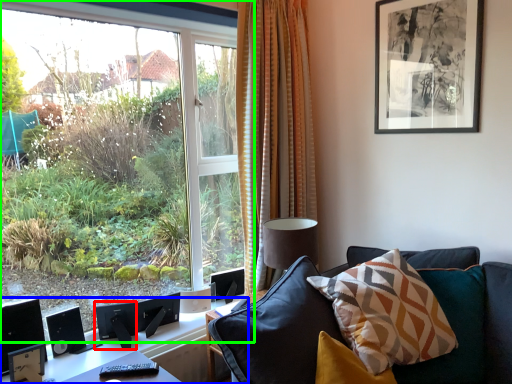
Question: Based on their relative distances, which object is nearer to speaker (highlighted by a red box)? Choose from table (highlighted by a blue box) and window (highlighted by a green box).

Choices:
 (A) table
 (B) window

Answer: (A)